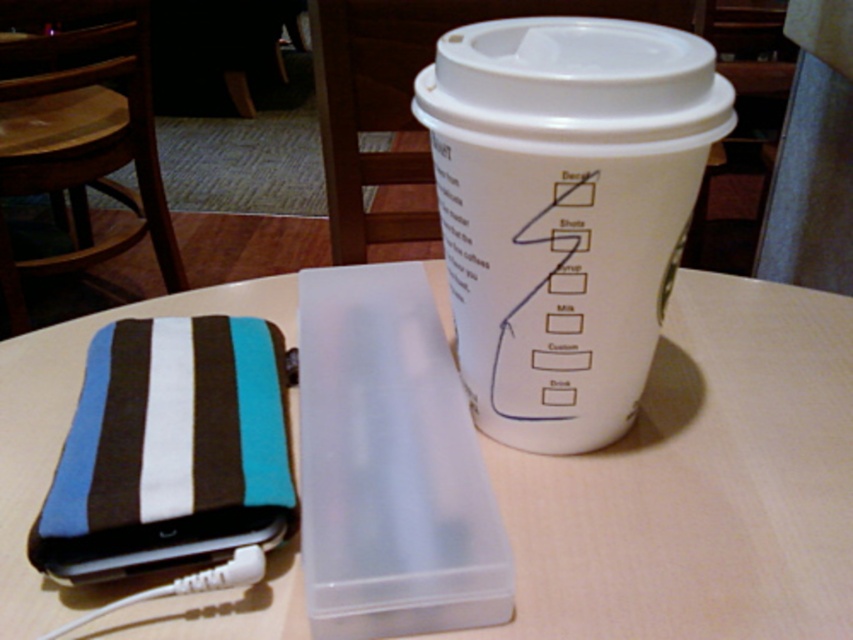
What do you see at coordinates (700, 484) in the screenshot? This screenshot has width=853, height=640. I see `white plastic container at center` at bounding box center [700, 484].

Is white plastic container at center smaller than white paper cup at upper right?

No, white plastic container at center is not smaller than white paper cup at upper right.

The height and width of the screenshot is (640, 853). What are the coordinates of `white plastic container at center` in the screenshot? It's located at (700, 484).